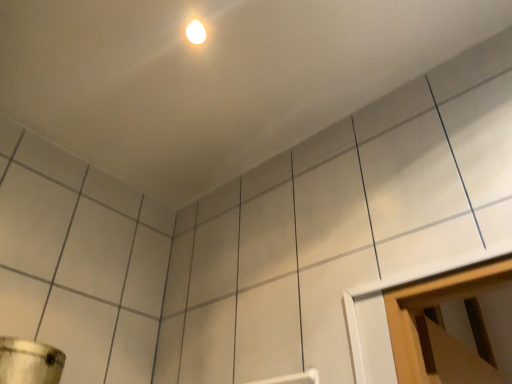
Measure the distance between white glossy light at upper center and camera.

white glossy light at upper center and camera are 3.76 feet apart.

The width and height of the screenshot is (512, 384). Identify the location of white glossy light at upper center. (196, 32).

This screenshot has width=512, height=384. Describe the element at coordinates (196, 32) in the screenshot. I see `white glossy light at upper center` at that location.

Image resolution: width=512 pixels, height=384 pixels. Find the location of `white glossy light at upper center`. white glossy light at upper center is located at coordinates (196, 32).